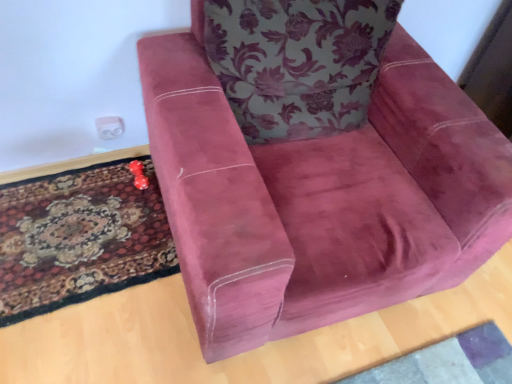
You are a GUI agent. You are given a task and a screenshot of the screen. Output one action in this format:
    pyautogui.click(x=<x>, y=<y>)
    Task: Click on the free space above carpeted rug at lower left (from a real-world perspective)
    
    Given the screenshot: What is the action you would take?
    pyautogui.click(x=86, y=226)